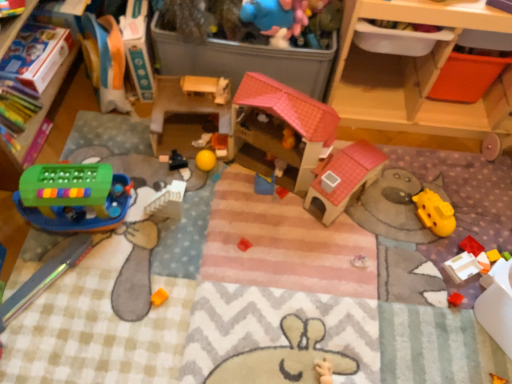
What are the coordinates of `unoccupied space behind metallic blue car at center, which is the 2th toy from left to right` in the screenshot? It's located at (176, 127).